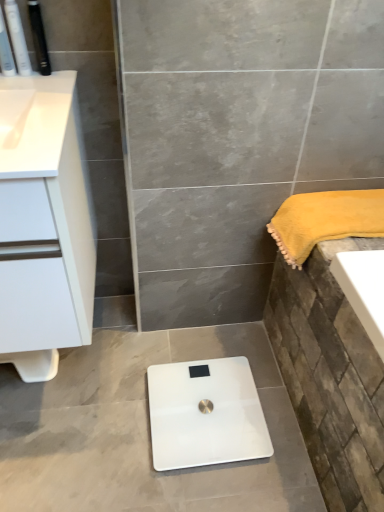
Question: In terms of width, does white plastic toothbrushes at upper left, the second toiletry in the left-to-right sequence, look wider or thinner when compared to white glossy scale at center?

Choices:
 (A) wide
 (B) thin

Answer: (B)

Question: Is white plastic toothbrushes at upper left, the second toiletry in the left-to-right sequence, in front of or behind white glossy scale at center in the image?

Choices:
 (A) behind
 (B) front

Answer: (B)

Question: Estimate the real-world distances between objects in this image. Which object is closer to the matte black toothbrush at upper left, the third toiletry positioned from the right?

Choices:
 (A) white glossy cabinet at upper left
 (B) white plastic toothbrushes at upper left, the second toiletry in the left-to-right sequence
 (C) yellow plush towel at right
 (D) white glossy scale at center
 (E) white matte cabinet at left

Answer: (B)

Question: Which is farther from the black plastic toothbrush at upper left, acting as the 1th toiletry starting from the right?

Choices:
 (A) yellow plush towel at right
 (B) matte black toothbrush at upper left, the third toiletry positioned from the right
 (C) white matte cabinet at left
 (D) white plastic toothbrushes at upper left, the second toiletry in the left-to-right sequence
 (E) white glossy scale at center

Answer: (E)